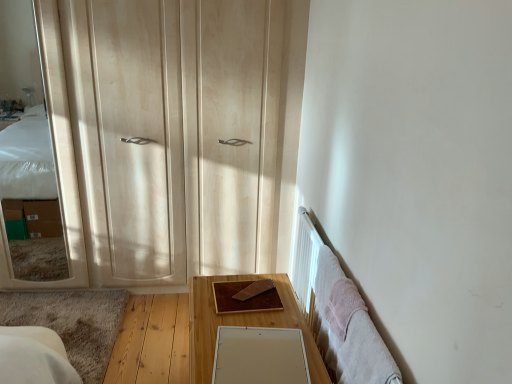
Locate an element on the screen. The image size is (512, 384). white matte mirror at lower center, which appears as the second mirror when viewed from the top is located at coordinates (260, 356).

Describe the element at coordinates (242, 324) in the screenshot. This screenshot has height=384, width=512. I see `brown wooden table at center` at that location.

Where is `matte wooden mirror at left, the 2th mirror viewed from the right`? matte wooden mirror at left, the 2th mirror viewed from the right is located at coordinates (55, 159).

Measure the distance from white matte mirror at lower center, the first mirror from the right, to matte wooden mirror at left, placed as the first mirror when sorted from top to bottom.

white matte mirror at lower center, the first mirror from the right, and matte wooden mirror at left, placed as the first mirror when sorted from top to bottom, are 4.77 feet apart from each other.

Is white matte mirror at lower center, which appears as the second mirror when viewed from the top, to the left of matte wooden mirror at left, the 2th mirror viewed from the right, from the viewer's perspective?

Incorrect, white matte mirror at lower center, which appears as the second mirror when viewed from the top, is not on the left side of matte wooden mirror at left, the 2th mirror viewed from the right.

How different are the orientations of white matte mirror at lower center, the first mirror from the right, and matte wooden mirror at left, the second mirror ordered from the bottom, in degrees?

94.7 degrees.

Identify the location of mirror located above the white matte mirror at lower center, the first mirror when ordered from front to back (from the image's perspective). The image size is (512, 384). (x=55, y=159).

Could brown wooden table at center be considered to be inside white matte mirror at lower center, which appears as the 2th mirror when viewed from the back?

No, white matte mirror at lower center, which appears as the 2th mirror when viewed from the back, does not contain brown wooden table at center.

Is point (219, 326) behind point (192, 278)?

No, it is in front of (192, 278).

Between white matte mirror at lower center, marked as the 2th mirror in a left-to-right arrangement, and brown wooden table at center, which one has smaller size?

With smaller size is white matte mirror at lower center, marked as the 2th mirror in a left-to-right arrangement.

Is white matte mirror at lower center, the 1th mirror in the bottom-to-top sequence, thinner than brown wooden table at center?

Yes.

Do you think brown wooden table at center is within light wood dresser at left, or outside of it?

brown wooden table at center exists outside the volume of light wood dresser at left.

Which of these two, brown wooden table at center or light wood dresser at left, is smaller?

light wood dresser at left is smaller.

Is brown wooden table at center facing towards light wood dresser at left?

No, brown wooden table at center does not turn towards light wood dresser at left.

Considering the relative sizes of matte wooden mirror at left, the 2th mirror viewed from the right, and brown wooden table at center in the image provided, is matte wooden mirror at left, the 2th mirror viewed from the right, thinner than brown wooden table at center?

Yes.

Is point (63, 127) farther from camera compared to point (205, 343)?

Yes.

Is matte wooden mirror at left, the first mirror positioned from the back, looking in the opposite direction of brown wooden table at center?

matte wooden mirror at left, the first mirror positioned from the back, does not have its back to brown wooden table at center.

Is brown wooden table at center surrounding white matte mirror at lower center, which appears as the second mirror when viewed from the top?

Indeed, white matte mirror at lower center, which appears as the second mirror when viewed from the top, is located within brown wooden table at center.

Can you tell me how much brown wooden table at center and white matte mirror at lower center, which appears as the second mirror when viewed from the top, differ in facing direction?

The angular difference between brown wooden table at center and white matte mirror at lower center, which appears as the second mirror when viewed from the top, is 7.94 degrees.

Is brown wooden table at center at the left side of white matte mirror at lower center, the first mirror when ordered from front to back?

Yes.

From the image's perspective, which is below, brown wooden table at center or white matte mirror at lower center, the 1th mirror in the bottom-to-top sequence?

brown wooden table at center, from the image's perspective.

From the picture: From a real-world perspective, relative to matte wooden mirror at left, acting as the 1th mirror starting from the left, is brown wooden table at center vertically above or below?

Clearly, from a real-world perspective, brown wooden table at center is below matte wooden mirror at left, acting as the 1th mirror starting from the left.

Considering the sizes of objects brown wooden table at center and matte wooden mirror at left, the first mirror positioned from the back, in the image provided, who is wider, brown wooden table at center or matte wooden mirror at left, the first mirror positioned from the back,?

Wider between the two is brown wooden table at center.

From the image's perspective, is brown wooden table at center above or below matte wooden mirror at left, the second mirror ordered from the bottom?

Based on their image positions, brown wooden table at center is located beneath matte wooden mirror at left, the second mirror ordered from the bottom.

Is brown wooden table at center oriented away from matte wooden mirror at left, acting as the 1th mirror starting from the left?

brown wooden table at center does not have its back to matte wooden mirror at left, acting as the 1th mirror starting from the left.

Can you tell me how much matte wooden mirror at left, placed as the first mirror when sorted from top to bottom, and white matte mirror at lower center, the 1th mirror in the bottom-to-top sequence, differ in facing direction?

The angular difference between matte wooden mirror at left, placed as the first mirror when sorted from top to bottom, and white matte mirror at lower center, the 1th mirror in the bottom-to-top sequence, is 94.7 degrees.

From the image's perspective, which is below, matte wooden mirror at left, acting as the 1th mirror starting from the left, or white matte mirror at lower center, the 1th mirror in the bottom-to-top sequence?

white matte mirror at lower center, the 1th mirror in the bottom-to-top sequence, is shown below in the image.

Does point (53, 39) lie in front of point (302, 378)?

No, it is not.

From a real-world perspective, is matte wooden mirror at left, the second mirror ordered from the bottom, on white matte mirror at lower center, the 1th mirror in the bottom-to-top sequence?

Yes, from a real-world perspective, matte wooden mirror at left, the second mirror ordered from the bottom, is above white matte mirror at lower center, the 1th mirror in the bottom-to-top sequence.

Identify the location of mirror below the matte wooden mirror at left, the first mirror positioned from the back (from the image's perspective). (260, 356).

Locate an element on the screen. The height and width of the screenshot is (384, 512). table behind the white matte mirror at lower center, marked as the 2th mirror in a left-to-right arrangement is located at coordinates (242, 324).

Considering their positions, is matte wooden mirror at left, the first mirror positioned from the back, positioned further to white matte mirror at lower center, which appears as the 2th mirror when viewed from the back, than brown wooden table at center?

Among the two, matte wooden mirror at left, the first mirror positioned from the back, is located further to white matte mirror at lower center, which appears as the 2th mirror when viewed from the back.

Looking at the image, which one is located further to brown wooden table at center, white matte mirror at lower center, the 1th mirror in the bottom-to-top sequence, or light wood dresser at left?

light wood dresser at left lies further to brown wooden table at center than the other object.

Consider the image. Based on their spatial positions, is brown wooden table at center or light wood dresser at left further from matte wooden mirror at left, the 2th mirror viewed from the right?

brown wooden table at center lies further to matte wooden mirror at left, the 2th mirror viewed from the right, than the other object.

Which object lies further to the anchor point matte wooden mirror at left, the 2th mirror viewed from the right, brown wooden table at center or white matte mirror at lower center, which appears as the second mirror when viewed from the top?

Based on the image, white matte mirror at lower center, which appears as the second mirror when viewed from the top, appears to be further to matte wooden mirror at left, the 2th mirror viewed from the right.

Which object lies further to the anchor point white matte mirror at lower center, which appears as the second mirror when viewed from the top, light wood dresser at left or brown wooden table at center?

Based on the image, light wood dresser at left appears to be further to white matte mirror at lower center, which appears as the second mirror when viewed from the top.

Looking at the image, which one is located further to white matte mirror at lower center, which appears as the 2th mirror when viewed from the back, brown wooden table at center or matte wooden mirror at left, the 2th mirror viewed from the right?

matte wooden mirror at left, the 2th mirror viewed from the right, lies further to white matte mirror at lower center, which appears as the 2th mirror when viewed from the back, than the other object.

Based on their spatial positions, is light wood dresser at left or matte wooden mirror at left, the second mirror ordered from the bottom, closer to white matte mirror at lower center, marked as the 2th mirror in a left-to-right arrangement?

light wood dresser at left is positioned closer to the anchor white matte mirror at lower center, marked as the 2th mirror in a left-to-right arrangement.

Which object lies nearer to the anchor point light wood dresser at left, matte wooden mirror at left, the second mirror ordered from the bottom, or brown wooden table at center?

Among the two, matte wooden mirror at left, the second mirror ordered from the bottom, is located nearer to light wood dresser at left.

Locate an element on the screen. Image resolution: width=512 pixels, height=384 pixels. dresser situated between matte wooden mirror at left, arranged as the second mirror when viewed from the front, and white matte mirror at lower center, which appears as the second mirror when viewed from the top, from left to right is located at coordinates (279, 128).

Find the location of a particular element. Image resolution: width=512 pixels, height=384 pixels. table located between matte wooden mirror at left, arranged as the second mirror when viewed from the front, and white matte mirror at lower center, which appears as the 2th mirror when viewed from the back, in the left-right direction is located at coordinates (242, 324).

You are a GUI agent. You are given a task and a screenshot of the screen. Output one action in this format:
    pyautogui.click(x=<x>, y=<y>)
    Task: Click on the dresser between matte wooden mirror at left, placed as the first mirror when sorted from top to bottom, and brown wooden table at center from left to right
    
    Given the screenshot: What is the action you would take?
    pyautogui.click(x=279, y=128)